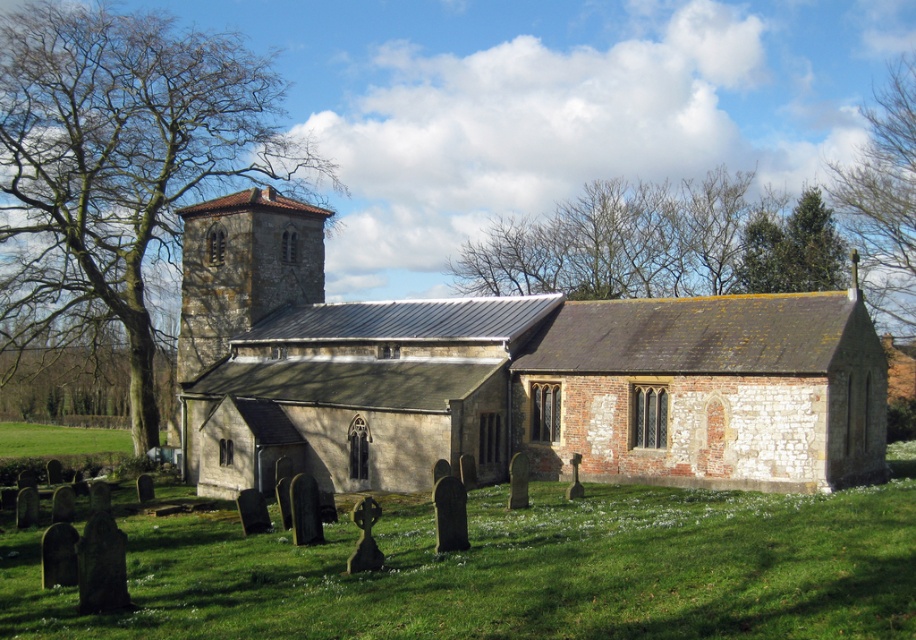
Question: Which point appears closest to the camera in this image?

Choices:
 (A) (134, 189)
 (B) (870, 109)

Answer: (A)

Question: Which of the following is the closest to the observer?

Choices:
 (A) green leafy tree at upper right
 (B) stone church at center
 (C) green leafy tree at upper center
 (D) green evergreen tree at upper right

Answer: (B)

Question: Among these points, which one is nearest to the camera?

Choices:
 (A) (93, 72)
 (B) (805, 262)
 (C) (695, 269)

Answer: (A)

Question: Can you confirm if green leafy tree at upper left is thinner than green leafy tree at upper right?

Choices:
 (A) no
 (B) yes

Answer: (B)

Question: Does stone church at center appear over green leafy tree at upper left?

Choices:
 (A) yes
 (B) no

Answer: (B)

Question: Can you confirm if stone church at center is wider than green evergreen tree at upper right?

Choices:
 (A) yes
 (B) no

Answer: (A)